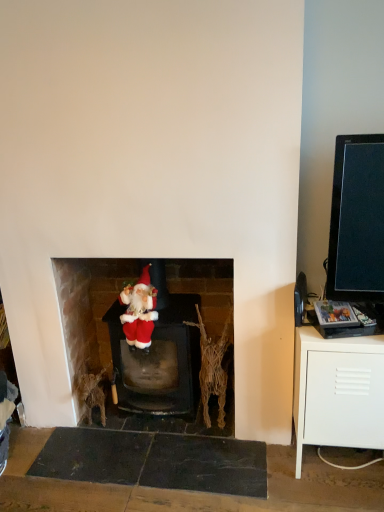
Question: Can you confirm if fuzzy fabric santa at center is bigger than white matte cabinet at right?

Choices:
 (A) no
 (B) yes

Answer: (A)

Question: From the image's perspective, does fuzzy fabric santa at center appear lower than white matte cabinet at right?

Choices:
 (A) yes
 (B) no

Answer: (B)

Question: Could you tell me if fuzzy fabric santa at center is facing white matte cabinet at right?

Choices:
 (A) yes
 (B) no

Answer: (B)

Question: Is fuzzy fabric santa at center thinner than white matte cabinet at right?

Choices:
 (A) yes
 (B) no

Answer: (A)

Question: Can you confirm if fuzzy fabric santa at center is wider than white matte cabinet at right?

Choices:
 (A) yes
 (B) no

Answer: (B)

Question: Considering the relative positions of fuzzy fabric santa at center and white matte cabinet at right in the image provided, is fuzzy fabric santa at center in front of white matte cabinet at right?

Choices:
 (A) no
 (B) yes

Answer: (A)

Question: From a real-world perspective, does white matte cabinet at right sit lower than velvet santa at center?

Choices:
 (A) yes
 (B) no

Answer: (A)

Question: Could velvet santa at center be considered to be inside white matte cabinet at right?

Choices:
 (A) no
 (B) yes

Answer: (A)

Question: Does white matte cabinet at right lie in front of velvet santa at center?

Choices:
 (A) no
 (B) yes

Answer: (B)

Question: Could you tell me if white matte cabinet at right is turned towards velvet santa at center?

Choices:
 (A) no
 (B) yes

Answer: (A)

Question: Is white matte cabinet at right far away from velvet santa at center?

Choices:
 (A) yes
 (B) no

Answer: (B)

Question: Is white matte cabinet at right next to velvet santa at center?

Choices:
 (A) yes
 (B) no

Answer: (B)

Question: Is velvet santa at center thinner than white matte cabinet at right?

Choices:
 (A) no
 (B) yes

Answer: (B)